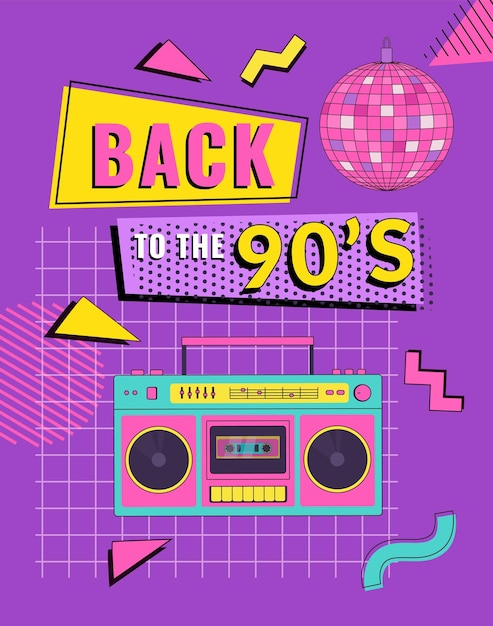
Locate an element on the screen. This screenshot has height=626, width=493. boombox handle is located at coordinates (213, 340).